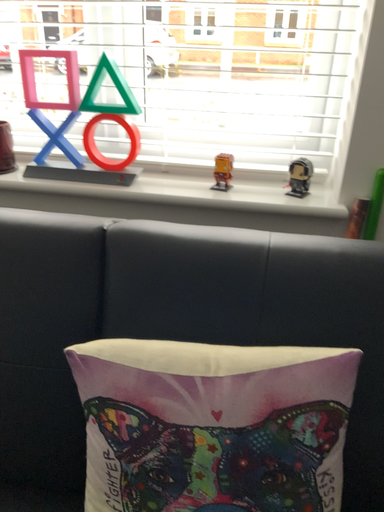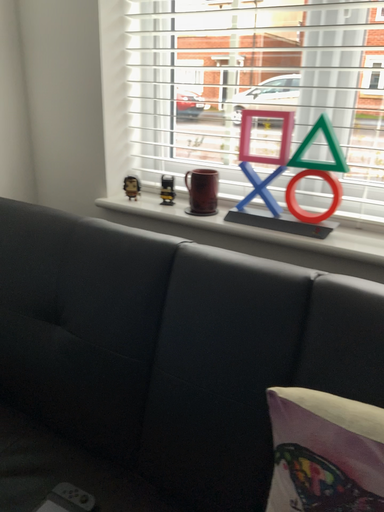
Question: Which way did the camera rotate in the video?

Choices:
 (A) rotated left
 (B) rotated right

Answer: (A)